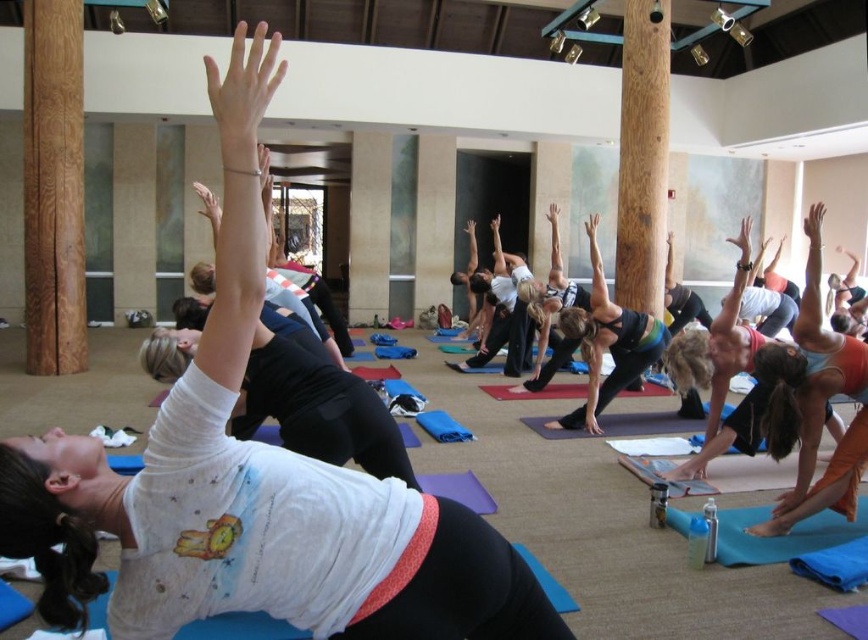
Question: Can you confirm if white matte yoga mat at center is positioned above blue fabric yoga mat at lower right?

Choices:
 (A) no
 (B) yes

Answer: (B)

Question: Which object appears farthest from the camera in this image?

Choices:
 (A) blue fabric yoga mat at lower right
 (B) white matte yoga mat at center

Answer: (A)

Question: From the image, what is the correct spatial relationship of white matte yoga mat at center in relation to blue fabric yoga mat at lower right?

Choices:
 (A) below
 (B) above

Answer: (B)

Question: Which of the following is the closest to the observer?

Choices:
 (A) blue fabric yoga mat at lower right
 (B) white matte yoga mat at center

Answer: (B)

Question: From the image, what is the correct spatial relationship of white matte yoga mat at center in relation to blue fabric yoga mat at lower right?

Choices:
 (A) right
 (B) left

Answer: (B)